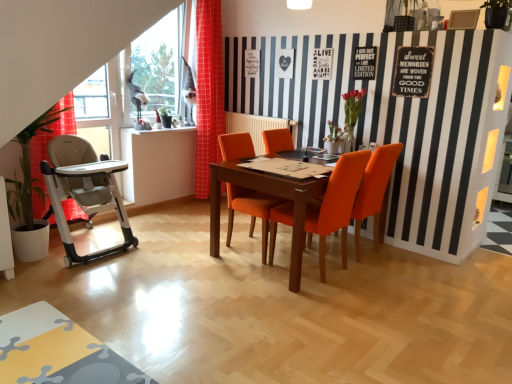
Where is `free spot in front of orange fabric chair at center, the 3th chair positioned from the left`? This screenshot has height=384, width=512. free spot in front of orange fabric chair at center, the 3th chair positioned from the left is located at coordinates (382, 277).